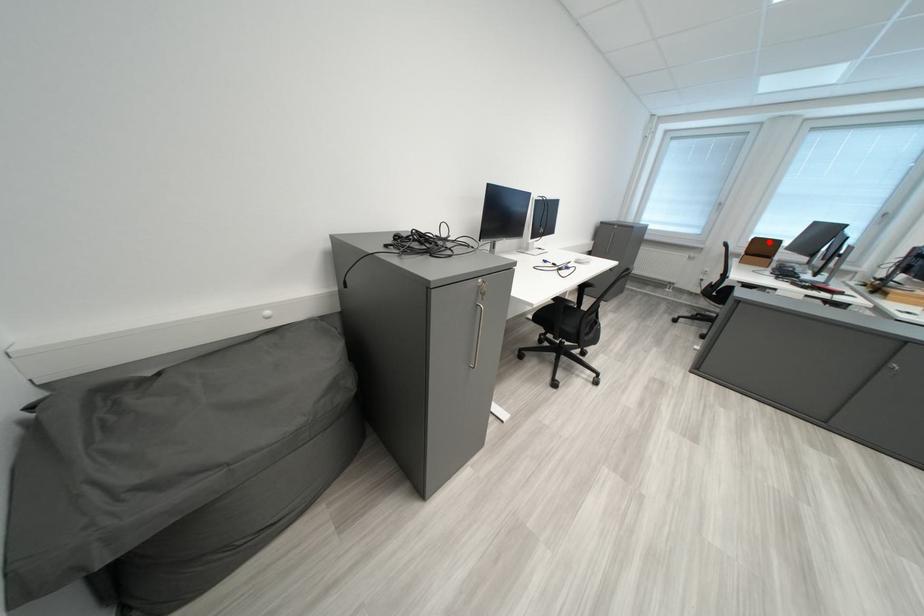
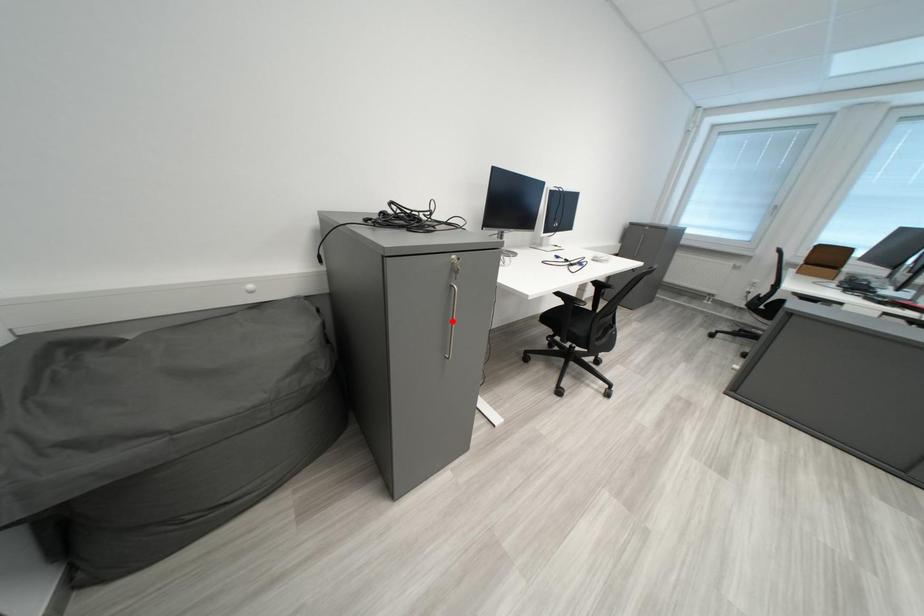
Looking at this image, I am providing you with two images of the same scene from different viewpoints. A red point is marked on the first image and another point is marked on the second image. Is the marked point in image1 the same physical position as the marked point in image2?

No